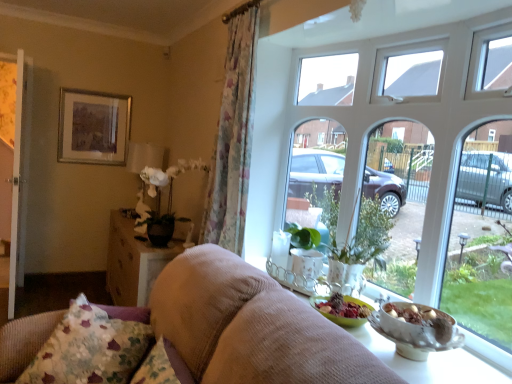
Question: Is white matte floral arrangement at center-left inside floral fabric curtain at left?

Choices:
 (A) yes
 (B) no

Answer: (B)

Question: Considering the relative sizes of floral fabric curtain at left and white matte floral arrangement at center-left in the image provided, is floral fabric curtain at left bigger than white matte floral arrangement at center-left?

Choices:
 (A) no
 (B) yes

Answer: (B)

Question: Does floral fabric curtain at left have a greater height compared to white matte floral arrangement at center-left?

Choices:
 (A) yes
 (B) no

Answer: (A)

Question: Is floral fabric curtain at left further to the viewer compared to white matte floral arrangement at center-left?

Choices:
 (A) no
 (B) yes

Answer: (A)

Question: Is floral fabric curtain at left turned away from white matte floral arrangement at center-left?

Choices:
 (A) no
 (B) yes

Answer: (A)

Question: From the image's perspective, is white glass window at upper center positioned above or below floral fabric curtain at left?

Choices:
 (A) below
 (B) above

Answer: (A)

Question: From a real-world perspective, is white glass window at upper center positioned above or below floral fabric curtain at left?

Choices:
 (A) below
 (B) above

Answer: (A)

Question: In terms of size, does white glass window at upper center appear bigger or smaller than floral fabric curtain at left?

Choices:
 (A) big
 (B) small

Answer: (A)

Question: Considering the positions of white glass window at upper center and floral fabric curtain at left in the image, is white glass window at upper center taller or shorter than floral fabric curtain at left?

Choices:
 (A) tall
 (B) short

Answer: (B)

Question: Is suede-like beige sofa at center wider or thinner than silver metallic picture frame at upper left?

Choices:
 (A) thin
 (B) wide

Answer: (B)

Question: Considering the relative positions of suede-like beige sofa at center and silver metallic picture frame at upper left in the image provided, is suede-like beige sofa at center to the left or to the right of silver metallic picture frame at upper left?

Choices:
 (A) left
 (B) right

Answer: (B)

Question: From the image's perspective, is suede-like beige sofa at center located above or below silver metallic picture frame at upper left?

Choices:
 (A) below
 (B) above

Answer: (A)

Question: Would you say suede-like beige sofa at center is inside or outside silver metallic picture frame at upper left?

Choices:
 (A) inside
 (B) outside

Answer: (B)

Question: In terms of width, does floral fabric curtain at left look wider or thinner when compared to white glass window at upper center?

Choices:
 (A) thin
 (B) wide

Answer: (A)

Question: Is point (244, 13) positioned closer to the camera than point (270, 173)?

Choices:
 (A) farther
 (B) closer

Answer: (B)